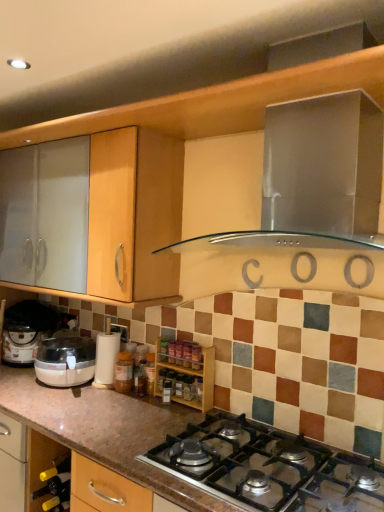
Locate an element on the screen. This screenshot has width=384, height=512. empty space that is ontop of wooden spice rack at center (from a real-world perspective) is located at coordinates (185, 343).